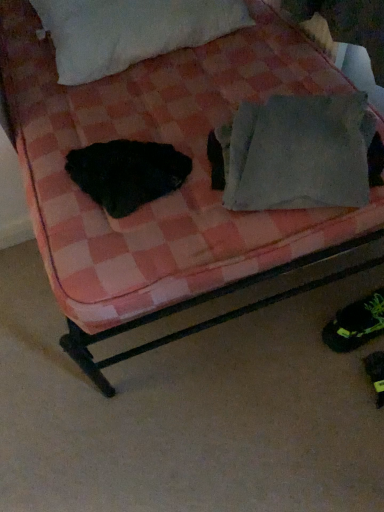
Question: From a real-world perspective, is black fuzzy animal at left physically above white fluffy pillow at upper center, the 2th pillow from the bottom?

Choices:
 (A) yes
 (B) no

Answer: (B)

Question: Is black fuzzy animal at left wider than white fluffy pillow at upper center, the second pillow when ordered from front to back?

Choices:
 (A) no
 (B) yes

Answer: (A)

Question: Is white fluffy pillow at upper center, positioned as the 1th pillow in left-to-right order, surrounded by black fuzzy animal at left?

Choices:
 (A) yes
 (B) no

Answer: (B)

Question: Is black fuzzy animal at left to the left of white fluffy pillow at upper center, the 1th pillow in the top-to-bottom sequence, from the viewer's perspective?

Choices:
 (A) no
 (B) yes

Answer: (A)

Question: From the image's perspective, is black fuzzy animal at left above white fluffy pillow at upper center, the second pillow when ordered from front to back?

Choices:
 (A) no
 (B) yes

Answer: (A)

Question: Is black fuzzy animal at left bigger or smaller than green synthetic shoe at lower right?

Choices:
 (A) big
 (B) small

Answer: (A)

Question: In terms of width, does black fuzzy animal at left look wider or thinner when compared to green synthetic shoe at lower right?

Choices:
 (A) thin
 (B) wide

Answer: (B)

Question: From the image's perspective, is black fuzzy animal at left located above or below green synthetic shoe at lower right?

Choices:
 (A) above
 (B) below

Answer: (A)

Question: Is point (185, 155) closer or farther from the camera than point (337, 349)?

Choices:
 (A) closer
 (B) farther

Answer: (A)

Question: From the image's perspective, is white fluffy pillow at upper center, positioned as the 1th pillow in left-to-right order, located above or below black fuzzy animal at left?

Choices:
 (A) above
 (B) below

Answer: (A)

Question: Relative to black fuzzy animal at left, is white fluffy pillow at upper center, the 2th pillow from the bottom, in front or behind?

Choices:
 (A) behind
 (B) front

Answer: (A)

Question: From a real-world perspective, relative to black fuzzy animal at left, is white fluffy pillow at upper center, the 1th pillow in the top-to-bottom sequence, vertically above or below?

Choices:
 (A) above
 (B) below

Answer: (A)

Question: Is white fluffy pillow at upper center, the 2th pillow from the bottom, situated inside black fuzzy animal at left or outside?

Choices:
 (A) inside
 (B) outside

Answer: (B)

Question: Is black fuzzy animal at left inside the boundaries of white fluffy pillow at upper center, marked as the second pillow in a right-to-left arrangement, or outside?

Choices:
 (A) inside
 (B) outside

Answer: (B)

Question: Does point (147, 157) appear closer or farther from the camera than point (41, 17)?

Choices:
 (A) closer
 (B) farther

Answer: (A)